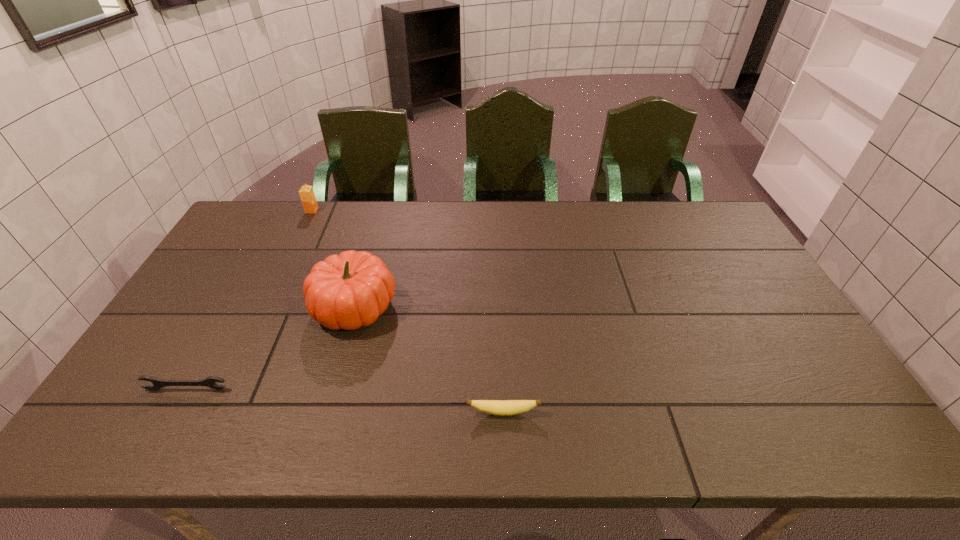
The height and width of the screenshot is (540, 960). Identify the location of blank area located 0.280m on the right of the nearest object. (660, 412).

This screenshot has width=960, height=540. In order to click on object at the far edge in this screenshot , I will do [x=306, y=193].

Identify the location of object present at the near edge. (495, 407).

At what (x,y) coordinates should I click in order to perform the action: click on object that is at the left edge. Please return your answer as a coordinate pair (x, y). The width and height of the screenshot is (960, 540). Looking at the image, I should click on (210, 381).

At what (x,y) coordinates should I click in order to perform the action: click on vacant area at the far edge of the desktop. Please return your answer as a coordinate pair (x, y). Looking at the image, I should click on click(x=440, y=201).

The image size is (960, 540). Identify the location of free space at the left edge. (231, 251).

Locate an element on the screen. This screenshot has width=960, height=540. free region at the right edge of the desktop is located at coordinates (771, 298).

Identify the location of vacant space at the near left corner of the desktop. (164, 416).

At what (x,y) coordinates should I click in order to perform the action: click on vacant space at the far right corner of the desktop. Please return your answer as a coordinate pair (x, y). The width and height of the screenshot is (960, 540). Looking at the image, I should click on (671, 203).

You are a GUI agent. You are given a task and a screenshot of the screen. Output one action in this format:
    pyautogui.click(x=<x>, y=<y>)
    Task: Click on the vacant area that lies between the rightmost object and the tallest object
    Image resolution: width=960 pixels, height=540 pixels.
    Given the screenshot: What is the action you would take?
    pyautogui.click(x=429, y=359)